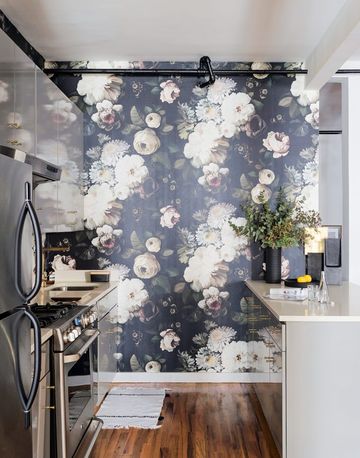
The image size is (360, 458). Find the location of `plant vase`. plant vase is located at coordinates (276, 264).